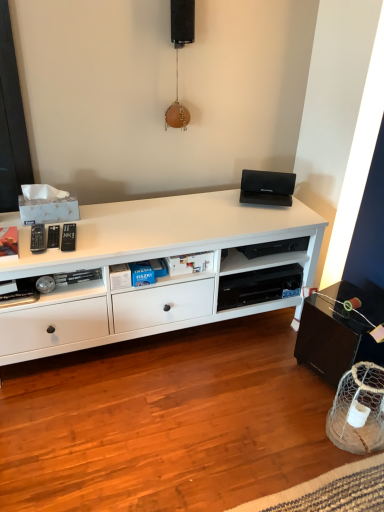
Question: Considering the relative sizes of black plastic shelf at center and black matte speaker at upper center in the image provided, is black plastic shelf at center smaller than black matte speaker at upper center?

Choices:
 (A) yes
 (B) no

Answer: (B)

Question: Could you tell me if black plastic shelf at center is facing black matte speaker at upper center?

Choices:
 (A) yes
 (B) no

Answer: (B)

Question: Considering the relative sizes of black plastic shelf at center and black matte speaker at upper center in the image provided, is black plastic shelf at center wider than black matte speaker at upper center?

Choices:
 (A) yes
 (B) no

Answer: (A)

Question: Is black matte speaker at upper center surrounded by black plastic shelf at center?

Choices:
 (A) yes
 (B) no

Answer: (B)

Question: Is black plastic shelf at center positioned with its back to black matte speaker at upper center?

Choices:
 (A) no
 (B) yes

Answer: (A)

Question: From the image's perspective, is black plastic shelf at center over black matte speaker at upper center?

Choices:
 (A) no
 (B) yes

Answer: (A)

Question: Is white matte cabinet at center to the left of black plastic shelf at center from the viewer's perspective?

Choices:
 (A) yes
 (B) no

Answer: (A)

Question: Could you tell me if white matte cabinet at center is facing black plastic shelf at center?

Choices:
 (A) no
 (B) yes

Answer: (B)

Question: Is white matte cabinet at center at the right side of black plastic shelf at center?

Choices:
 (A) yes
 (B) no

Answer: (B)

Question: Considering the relative sizes of white matte cabinet at center and black plastic shelf at center in the image provided, is white matte cabinet at center wider than black plastic shelf at center?

Choices:
 (A) yes
 (B) no

Answer: (A)

Question: Is white matte cabinet at center further to the viewer compared to black plastic shelf at center?

Choices:
 (A) yes
 (B) no

Answer: (B)

Question: Does white matte cabinet at center have a smaller size compared to black plastic shelf at center?

Choices:
 (A) no
 (B) yes

Answer: (A)

Question: Is black matte speaker at upper center oriented away from black plastic shelf at center?

Choices:
 (A) no
 (B) yes

Answer: (A)